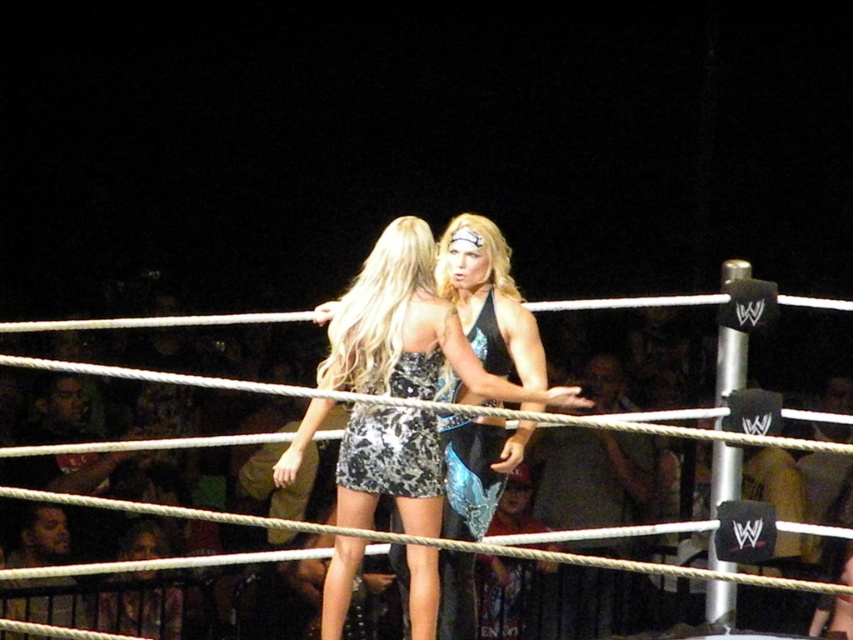
You are a photographer at the wrestling ring and need to adjust your camera focus. Which dress, the sparkly metallic dress at center or the shiny metallic dress at center, requires a wider aperture setting due to its size?

The sparkly metallic dress at center requires a wider aperture setting because it is larger in size compared to the shiny metallic dress at center, allowing for better focus on its details.

You are a photographer positioned at the center of the wrestling ring. You want to capture a closeup shot of the sparkly metallic dress at center. Based on its position, will you need to move left or right to frame it properly?

The sparkly metallic dress at center is located at point [409,330], which is very close to the center of the frame. Therefore, you do not need to move left or right to frame it properly.

In the wrestling ring scene, there are two women facing each other. The woman on the left is wearing a black and white patterned dress with a halter neck design, and the woman on the right has a black tank top and a blue and teal patterned skirt. There is a point at coordinates (409, 330). Which woman is this point closer to?

The point at coordinates (409, 330) is on the sparkly metallic dress at center, so it is closer to the woman wearing the sparkly metallic dress.